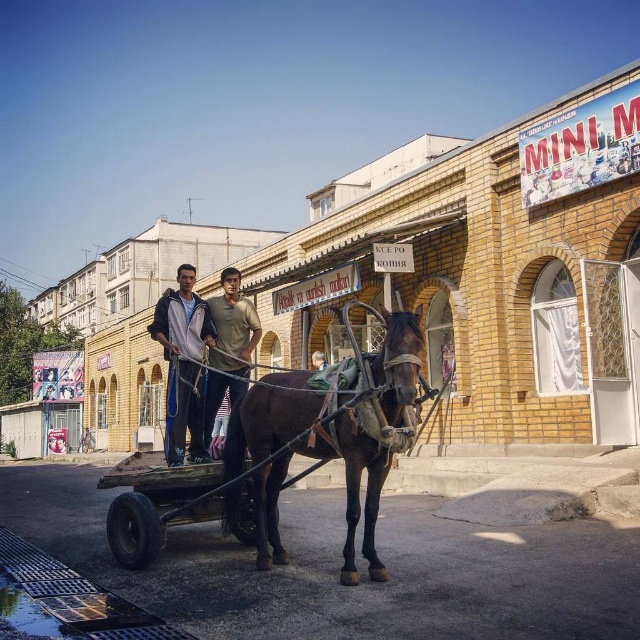
Question: Is shiny brown horse at center below light brown leather jacket at center?

Choices:
 (A) yes
 (B) no

Answer: (B)

Question: Which of the following is the closest to the observer?

Choices:
 (A) (189, 282)
 (B) (355, 460)

Answer: (B)

Question: Considering the real-world distances, which object is farthest from the light brown cotton shirt at center?

Choices:
 (A) light brown leather jacket at center
 (B) shiny brown horse at center

Answer: (A)

Question: Can you confirm if shiny brown horse at center is positioned to the right of light brown cotton shirt at center?

Choices:
 (A) no
 (B) yes

Answer: (B)

Question: Which of the following is the closest to the observer?

Choices:
 (A) shiny brown horse at center
 (B) light brown cotton shirt at center
 (C) light brown leather jacket at center

Answer: (A)

Question: From the image, what is the correct spatial relationship of shiny brown horse at center in relation to light brown cotton shirt at center?

Choices:
 (A) above
 (B) below

Answer: (A)